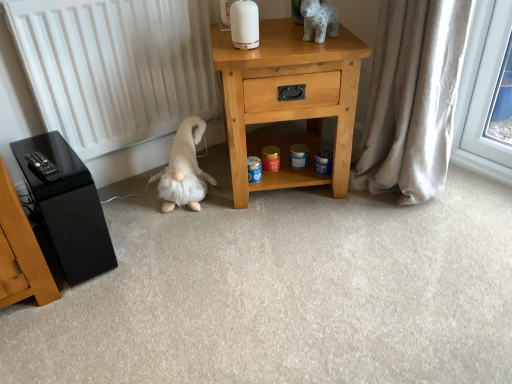
At what (x,y) coordinates should I click in order to perform the action: click on free space in front of beige fabric curtain at right. Please return your answer as a coordinate pair (x, y). Looking at the image, I should click on (415, 229).